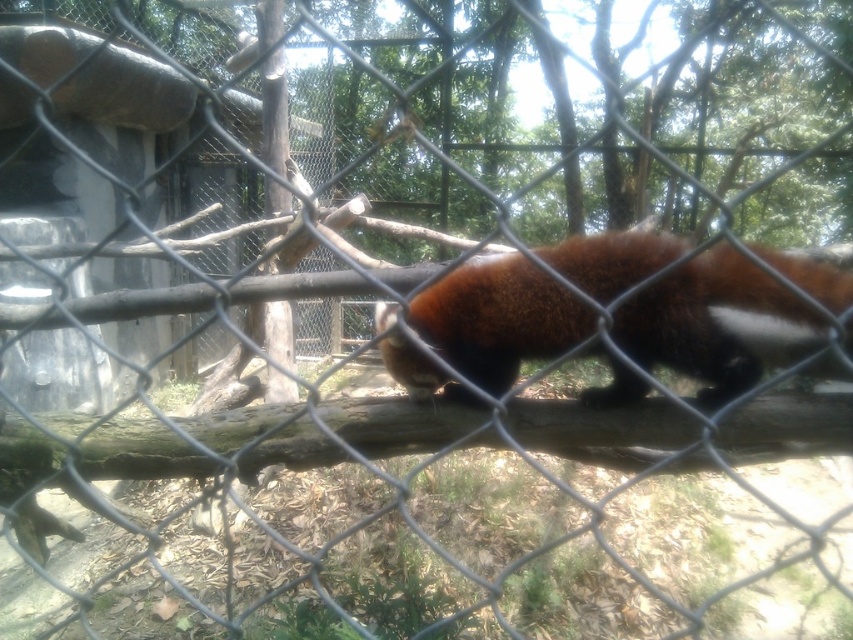
You are a zookeeper who needs to feed the red panda. You have a food container that you can place on the brown rough wood at center. The fuzzy brown fur at center is where the red panda is currently located. Can you estimate if the red panda can reach the food from its current position without moving more than 10 inches?

The distance between the fuzzy brown fur at center and the brown rough wood at center is 9.50 inches. Since the red panda only needs to move 9.50 inches to reach the food, which is within the 10 inches limit, the red panda can easily access the food without moving more than the allowed distance.

You are a zookeeper observing the red panda through the fence. You notice the fuzzy brown fur at center and the brown rough wood at center. Which object is closer to you?

The fuzzy brown fur at center is closer to you because it is in front of the brown rough wood at center.

You are a zookeeper observing the red panda enclosure. You notice the fuzzy brown fur at center and the brown rough wood at center. From your viewpoint, which object is positioned to the right?

The fuzzy brown fur at center is to the right of brown rough wood at center, so the fuzzy brown fur at center is positioned to the right.